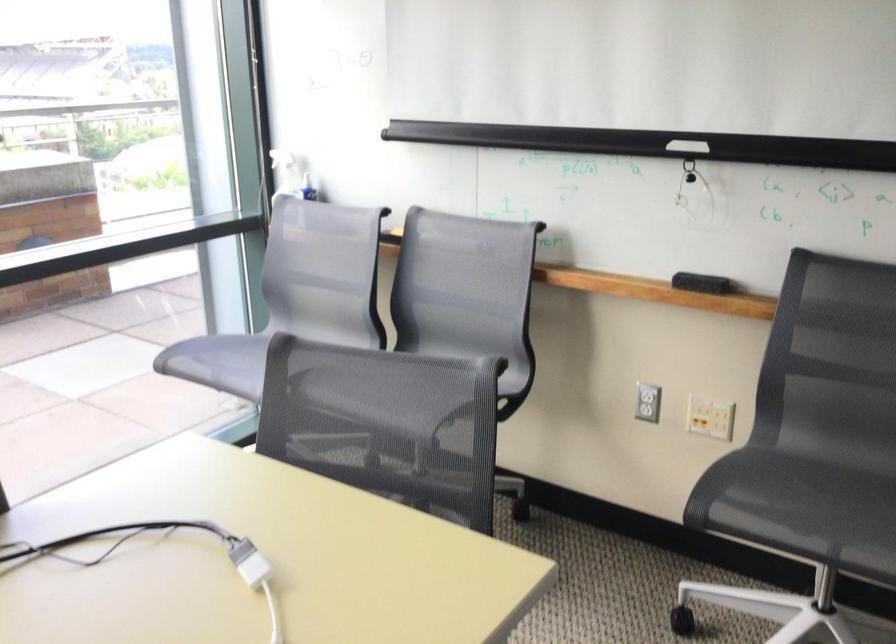
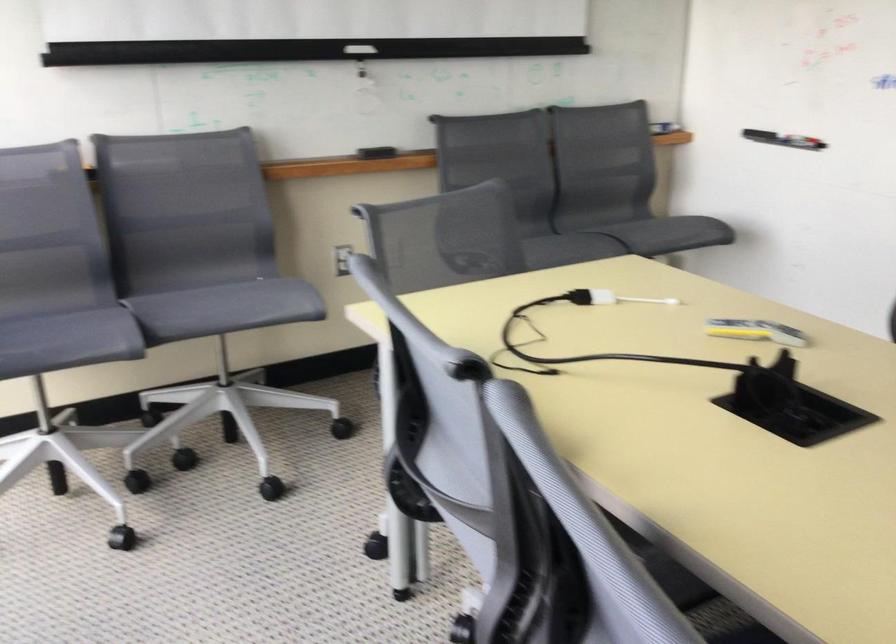
Question: I am providing you with two images of the same scene from different viewpoints. Please identify which objects are invisible in image2.

Choices:
 (A) white cable adapter
 (B) grey mesh chair sitting surface
 (C) green chair's surface
 (D) whiteboard marker

Answer: (B)